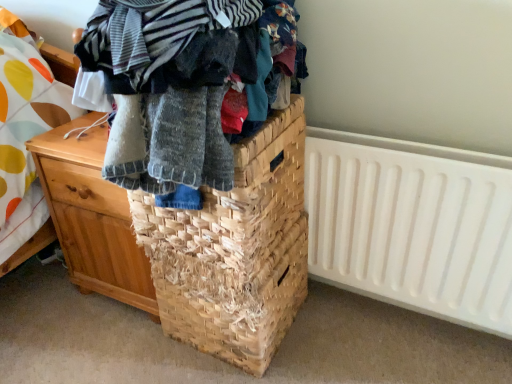
The image size is (512, 384). Find the location of `vacant area that is situated to the right of natural fiber basket at center`. vacant area that is situated to the right of natural fiber basket at center is located at coordinates (335, 340).